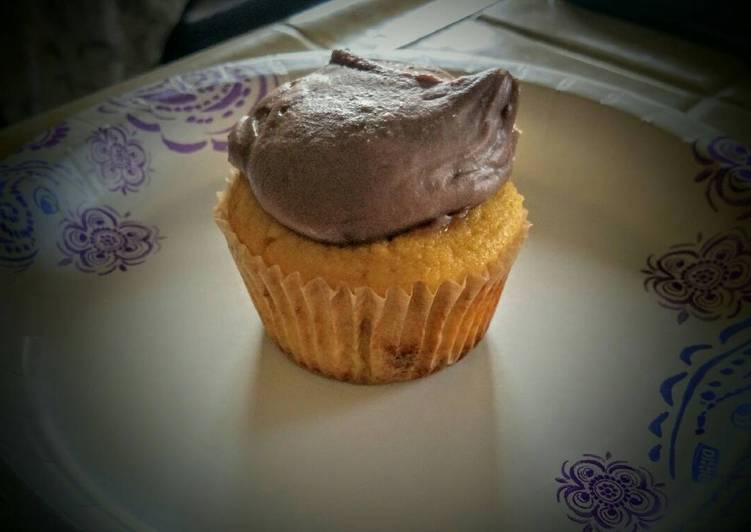
The width and height of the screenshot is (751, 532). I want to click on counter top, so tap(490, 30).